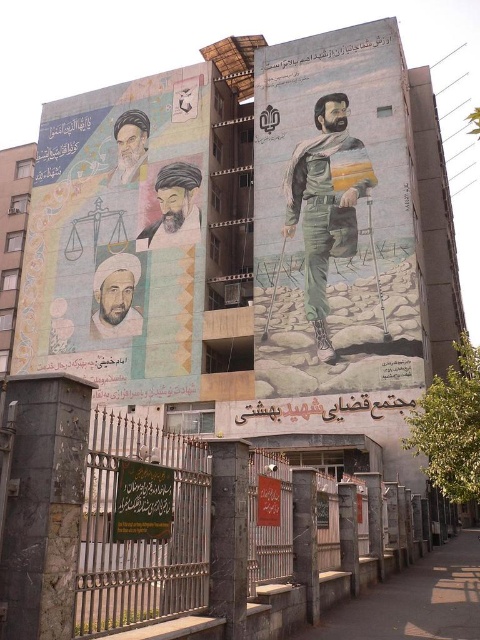
Question: Observing the image, what is the correct spatial positioning of matte green uniform at center in reference to matte black portrait at upper left?

Choices:
 (A) above
 (B) below

Answer: (B)

Question: Does pastel-colored turban at center appear under matte black portrait at upper left?

Choices:
 (A) no
 (B) yes

Answer: (B)

Question: Can you confirm if matte green uniform at center is positioned to the left of matte white beard at center?

Choices:
 (A) no
 (B) yes

Answer: (A)

Question: Among these points, which one is farthest from the camera?

Choices:
 (A) (189, 189)
 (B) (320, 113)
 (C) (124, 323)
 (D) (162, 161)

Answer: (D)

Question: Which point is closer to the camera?

Choices:
 (A) matte black portrait at upper left
 (B) matte paper poster at left
 (C) matte green uniform at center

Answer: (C)

Question: Which object appears closest to the camera in this image?

Choices:
 (A) matte white beard at center
 (B) matte black portrait at upper left

Answer: (A)